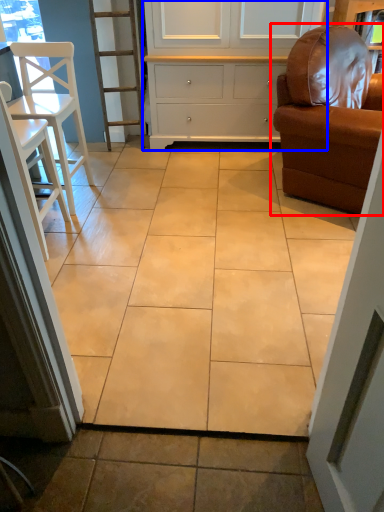
Question: Which point is closer to the camera, chair (highlighted by a red box) or cabinetry (highlighted by a blue box)?

Choices:
 (A) chair
 (B) cabinetry

Answer: (A)